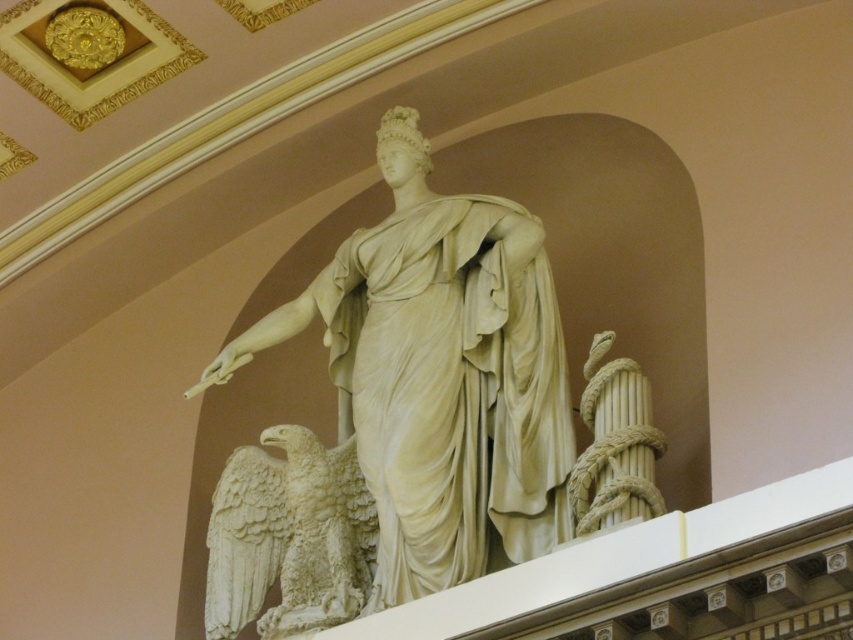
Who is taller, white marble statue at center or white marble eagle at lower left?

Standing taller between the two is white marble statue at center.

Does white marble statue at center have a larger size compared to white marble eagle at lower left?

Yes, white marble statue at center is bigger than white marble eagle at lower left.

Find the location of a particular element. This screenshot has height=640, width=853. white marble statue at center is located at coordinates (440, 376).

The image size is (853, 640). Identify the location of white marble statue at center. (440, 376).